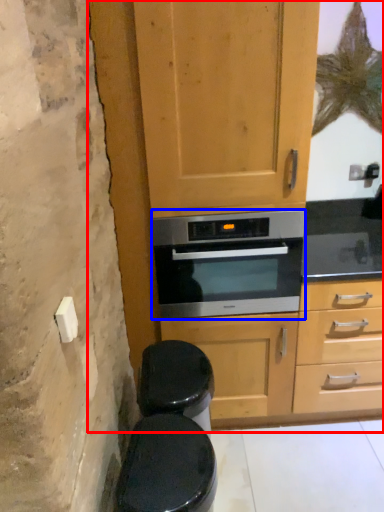
Question: Which point is closer to the camera, dresser (highlighted by a red box) or oven (highlighted by a blue box)?

Choices:
 (A) dresser
 (B) oven

Answer: (A)